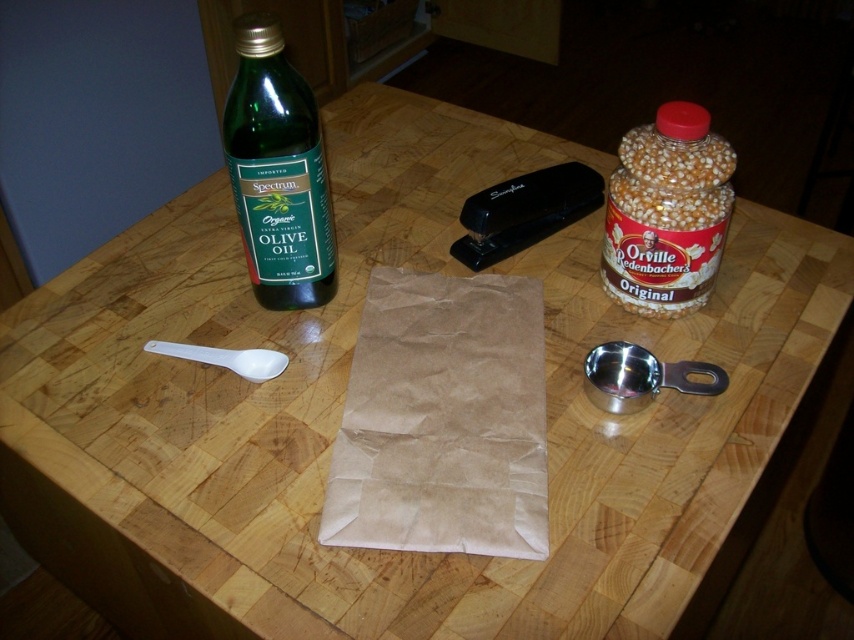
Question: Is brown paper bag at center further to camera compared to white plastic spoon at left?

Choices:
 (A) no
 (B) yes

Answer: (A)

Question: Which point is closer to the camera?

Choices:
 (A) (542, 406)
 (B) (722, 211)

Answer: (A)

Question: Considering the real-world distances, which object is farthest from the green glass bottle at left?

Choices:
 (A) brown paper bag at center
 (B) translucent plastic popcorn container at right

Answer: (B)

Question: Is the position of green glass bottle at left more distant than that of white plastic spoon at left?

Choices:
 (A) yes
 (B) no

Answer: (B)

Question: Is translucent plastic popcorn container at right below white plastic spoon at left?

Choices:
 (A) yes
 (B) no

Answer: (B)

Question: Which object appears farthest from the camera in this image?

Choices:
 (A) translucent plastic popcorn container at right
 (B) green glass bottle at left

Answer: (A)